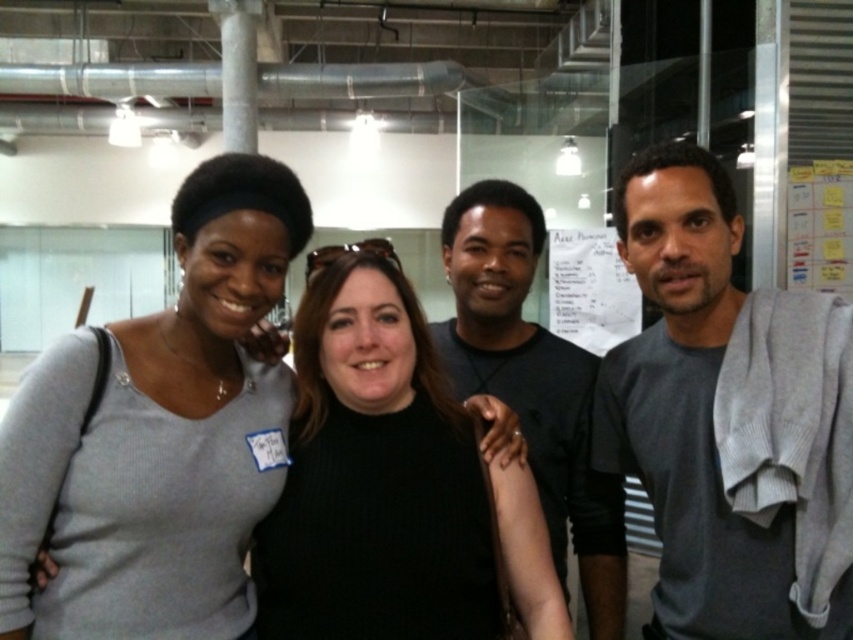
Question: Can you confirm if gray cotton shirt at right is positioned to the right of dark gray shirt at center?

Choices:
 (A) yes
 (B) no

Answer: (A)

Question: Does gray cotton shirt at right appear over matte gray sweater at center?

Choices:
 (A) no
 (B) yes

Answer: (A)

Question: Can you confirm if matte gray sweater at center is positioned below dark gray shirt at center?

Choices:
 (A) no
 (B) yes

Answer: (A)

Question: Which object is closer to the camera taking this photo?

Choices:
 (A) dark gray shirt at center
 (B) matte gray sweater at center
 (C) gray cotton shirt at right

Answer: (B)

Question: Based on their relative distances, which object is farther from the dark gray shirt at center?

Choices:
 (A) gray cotton shirt at right
 (B) matte gray sweater at center

Answer: (B)

Question: Which point is closer to the camera taking this photo?

Choices:
 (A) (123, 435)
 (B) (682, 406)
 (C) (480, 392)

Answer: (A)